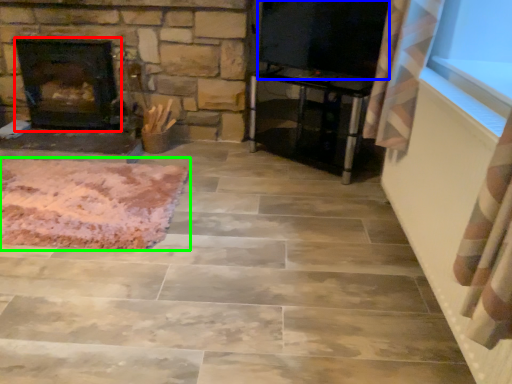
Question: Estimate the real-world distances between objects in this image. Which object is farther from fireplace (highlighted by a red box), window screen (highlighted by a blue box) or mat (highlighted by a green box)?

Choices:
 (A) window screen
 (B) mat

Answer: (A)